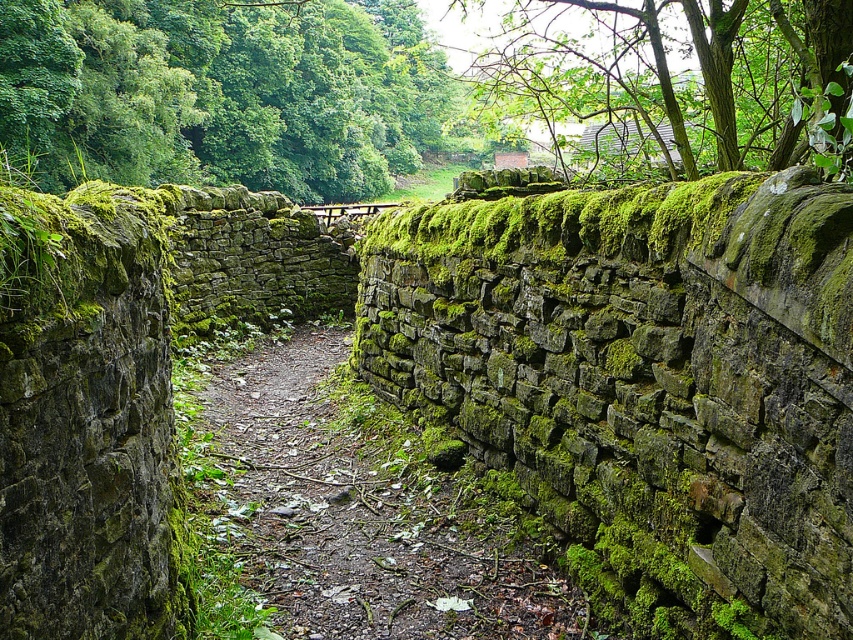
Question: Does green leafy tree at upper left lie in front of green mossy stone path at center?

Choices:
 (A) no
 (B) yes

Answer: (A)

Question: Which of these objects is positioned farthest from the green mossy stone path at center?

Choices:
 (A) green mossy stone at upper center
 (B) green leafy tree at upper left
 (C) green leafy tree at upper right
 (D) green mossy stone wall at upper center

Answer: (B)

Question: Which object is farther from the camera taking this photo?

Choices:
 (A) green mossy stone at upper center
 (B) green mossy stone path at center
 (C) green leafy tree at upper left
 (D) green mossy stone wall at upper center

Answer: (C)

Question: Which point appears farthest from the camera in this image?

Choices:
 (A) (492, 579)
 (B) (392, 44)

Answer: (B)

Question: Does green mossy stone at upper center have a greater width compared to green leafy tree at upper left?

Choices:
 (A) no
 (B) yes

Answer: (A)

Question: Is green mossy stone at upper center wider than green mossy stone wall at upper center?

Choices:
 (A) yes
 (B) no

Answer: (A)